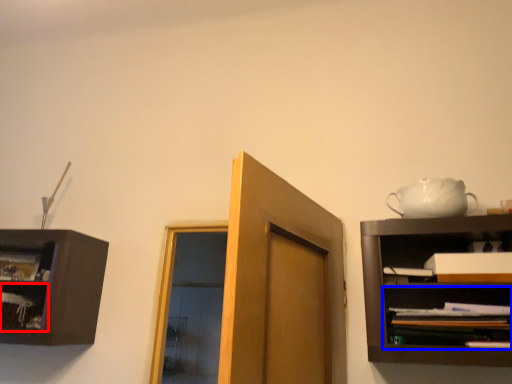
Question: Among these objects, which one is farthest to the camera, shelf (highlighted by a red box) or shelf (highlighted by a blue box)?

Choices:
 (A) shelf
 (B) shelf

Answer: (A)